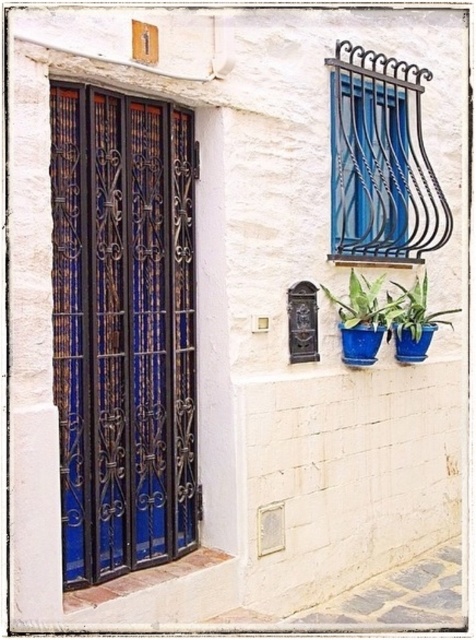
Can you confirm if wrought iron window frame at upper right is positioned below blue ceramic pot at lower right?

No.

At what (x,y) coordinates should I click in order to perform the action: click on wrought iron window frame at upper right. Please return your answer as a coordinate pair (x, y). This screenshot has width=476, height=640. Looking at the image, I should click on (380, 161).

Is blue matte metal door at left wider than wrought iron window frame at upper right?

No.

What do you see at coordinates (122, 330) in the screenshot?
I see `blue matte metal door at left` at bounding box center [122, 330].

Locate an element on the screen. blue matte metal door at left is located at coordinates (122, 330).

Is wrought iron window frame at upper right wider than blue glossy pot at center?

Correct, the width of wrought iron window frame at upper right exceeds that of blue glossy pot at center.

Which is behind, point (365, 209) or point (353, 272)?

Point (365, 209)

Who is more distant from viewer, (335,54) or (366,310)?

Positioned behind is point (335,54).

You are a GUI agent. You are given a task and a screenshot of the screen. Output one action in this format:
    pyautogui.click(x=<x>, y=<y>)
    Task: Click on the wrought iron window frame at upper right
    The image size is (476, 640).
    Given the screenshot: What is the action you would take?
    pyautogui.click(x=380, y=161)